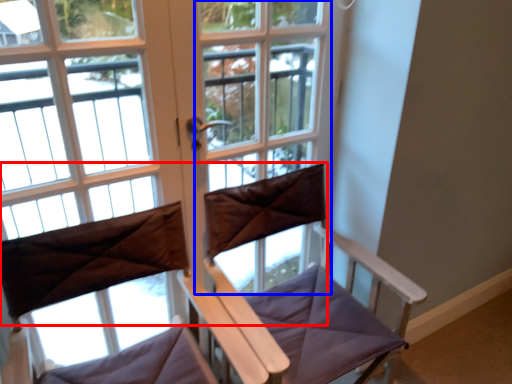
Question: Which of the following is the closest to the observer, curtain (highlighted by a red box) or screen door (highlighted by a blue box)?

Choices:
 (A) curtain
 (B) screen door

Answer: (A)